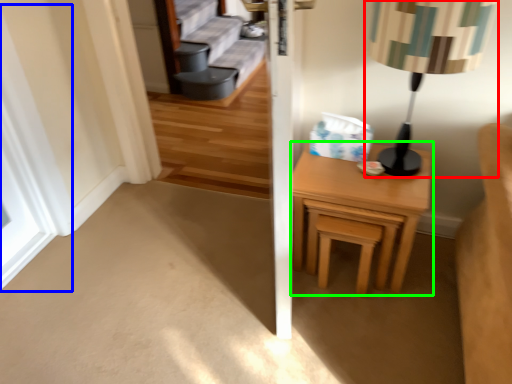
Question: Which object is positioned closest to table lamp (highlighted by a red box)? Select from window (highlighted by a blue box) and nightstand (highlighted by a green box).

Choices:
 (A) window
 (B) nightstand

Answer: (B)